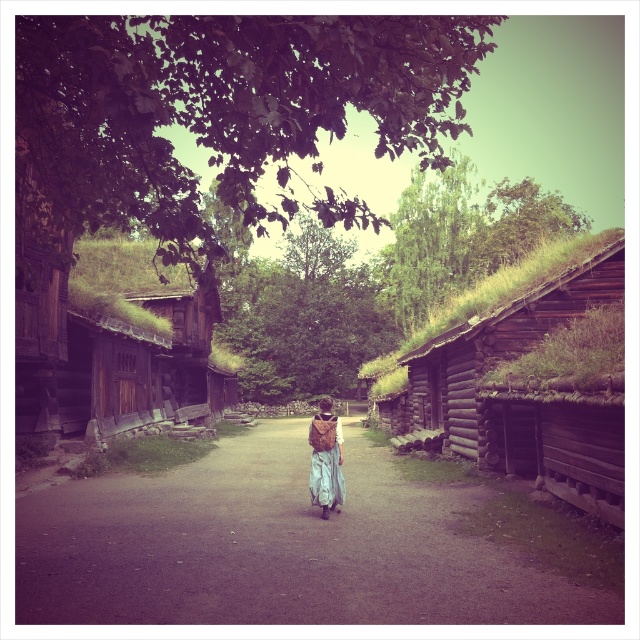
Question: Which point appears closest to the camera in this image?

Choices:
 (A) (324, 424)
 (B) (196, 572)
 (C) (474, 428)
 (D) (248, 198)

Answer: (B)

Question: Which point is closer to the camera?

Choices:
 (A) (323, 408)
 (B) (144, 72)
 (C) (88, 595)
 (D) (524, 438)

Answer: (B)

Question: Can you confirm if brown dirt path at center is positioned to the right of green moss-covered log cabin at center-right?

Choices:
 (A) no
 (B) yes

Answer: (A)

Question: Which is farther from the green leafy tree at upper center?

Choices:
 (A) brown dirt path at center
 (B) light brown fabric dress at center
 (C) green moss-covered log cabin at center-right

Answer: (B)

Question: Does brown dirt path at center appear on the left side of green leafy tree at upper center?

Choices:
 (A) yes
 (B) no

Answer: (B)

Question: Is brown dirt path at center to the left of green leafy tree at upper center from the viewer's perspective?

Choices:
 (A) yes
 (B) no

Answer: (B)